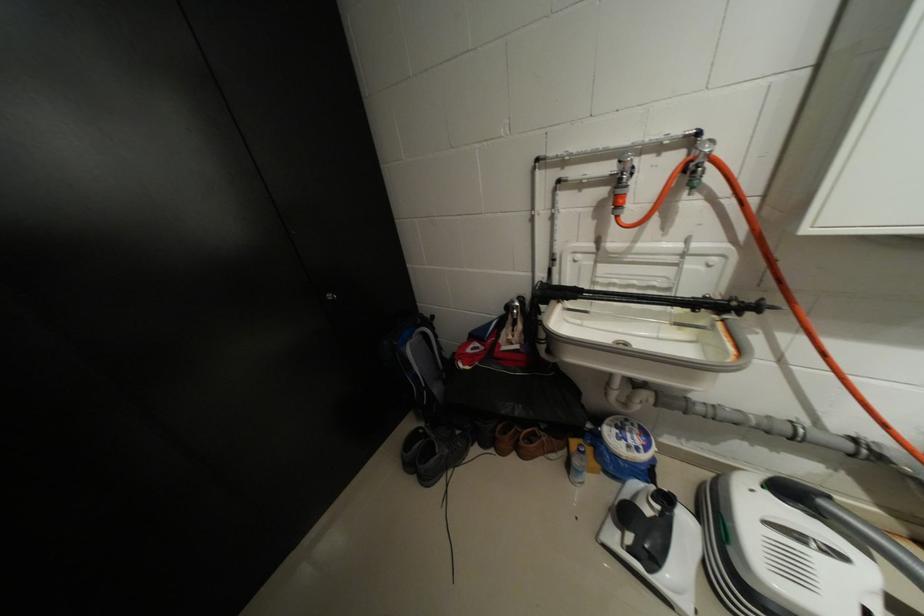
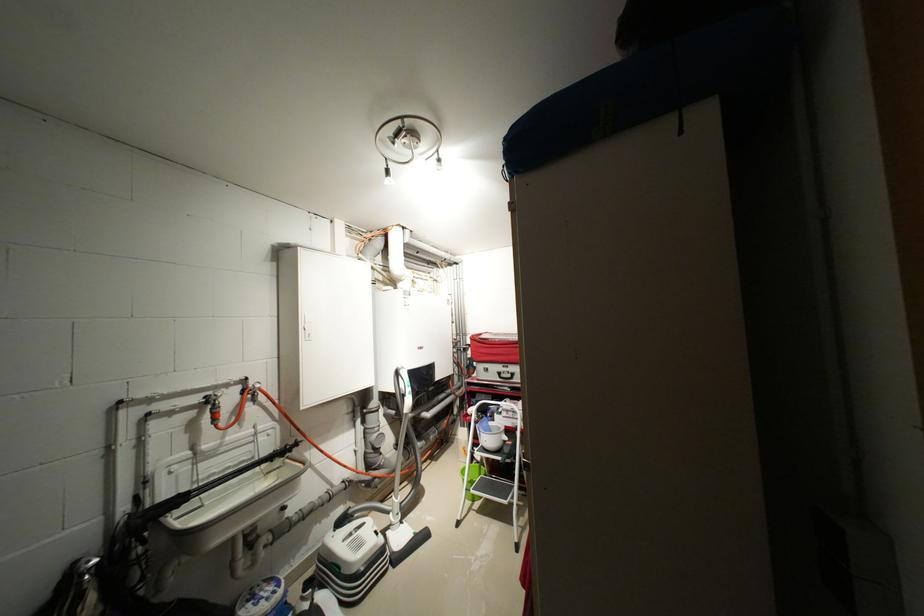
Locate, in the second image, the point that corresponds to the point at 709,269 in the first image.

(273, 439)